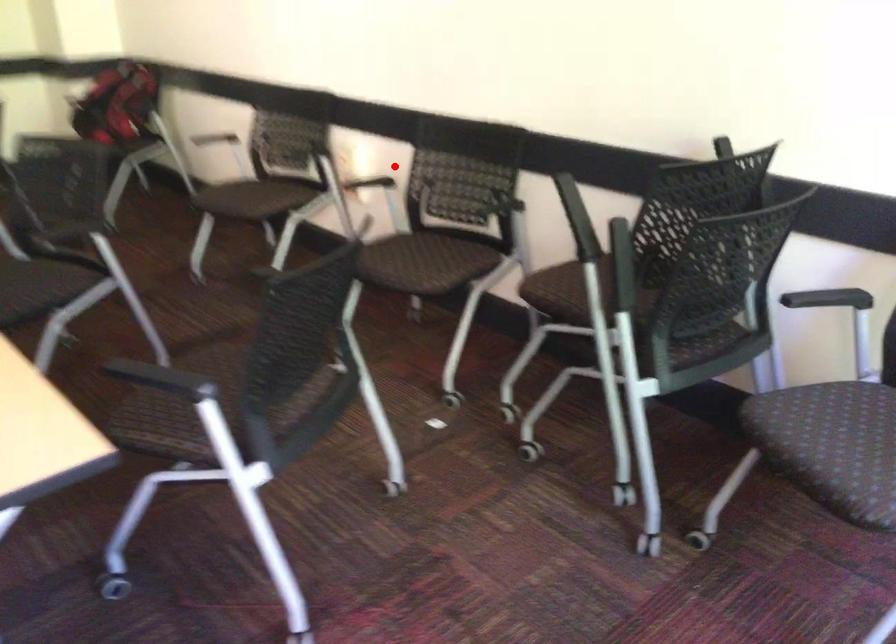
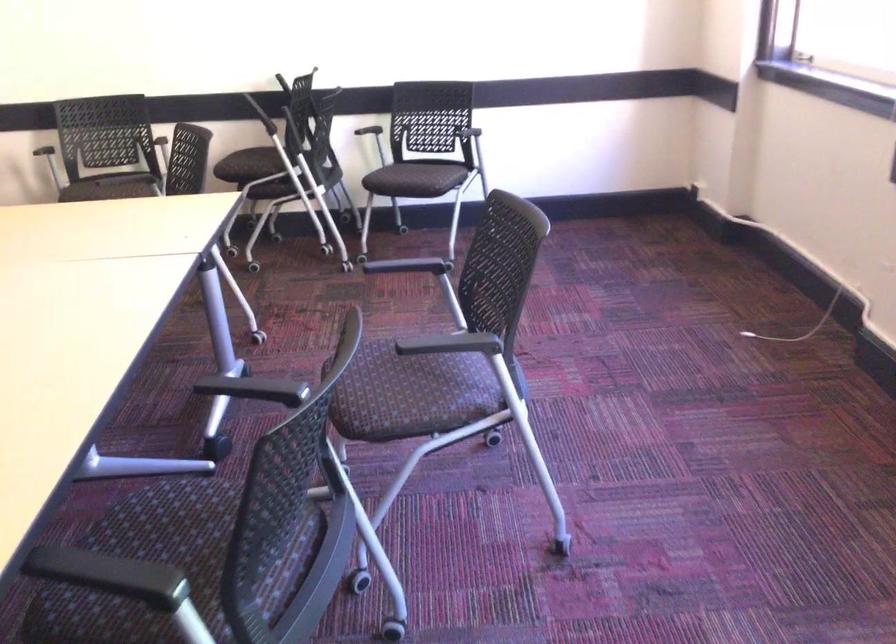
Locate, in the second image, the point that corresponds to the highlighted location in the first image.

(30, 140)